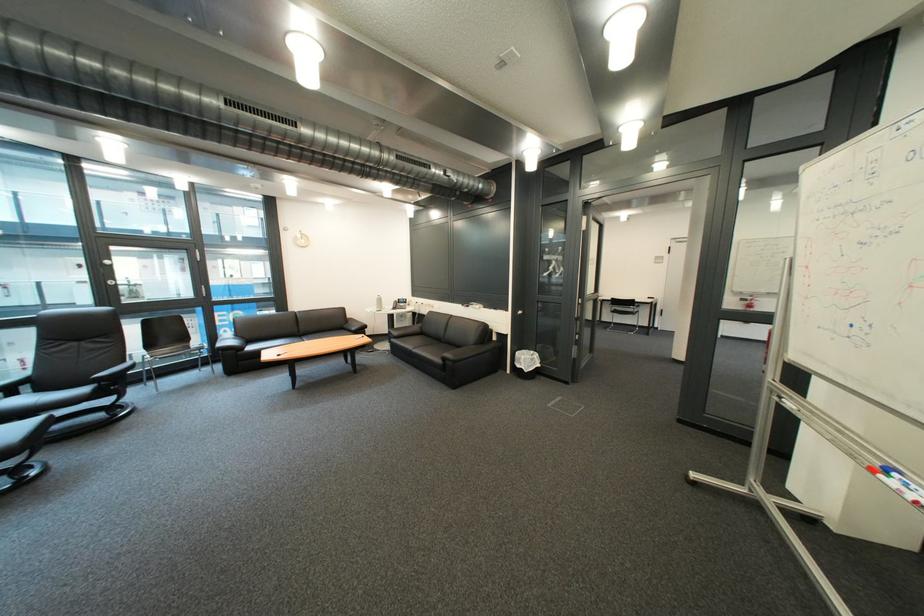
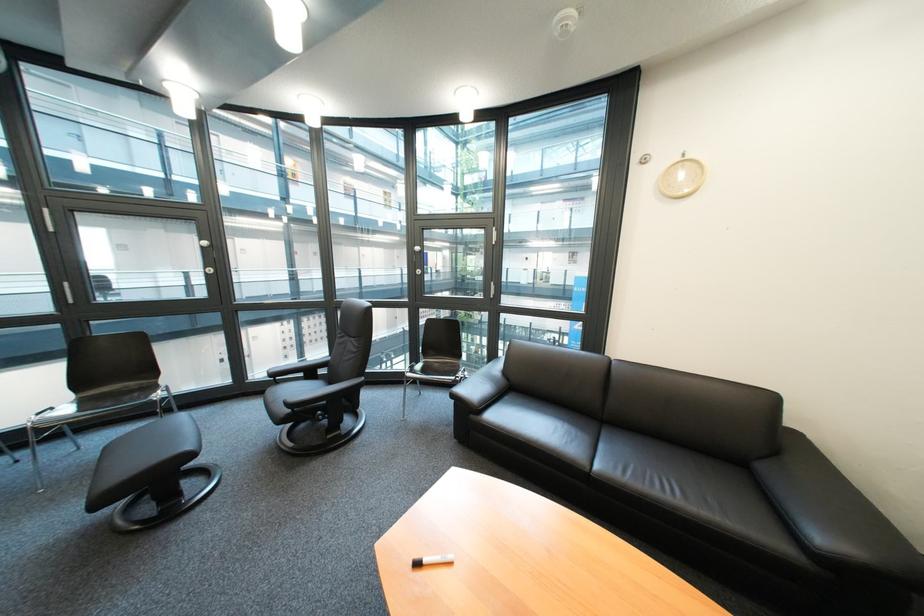
In the second image, find the point that corresponds to the point at 368,331 in the first image.

(833, 540)